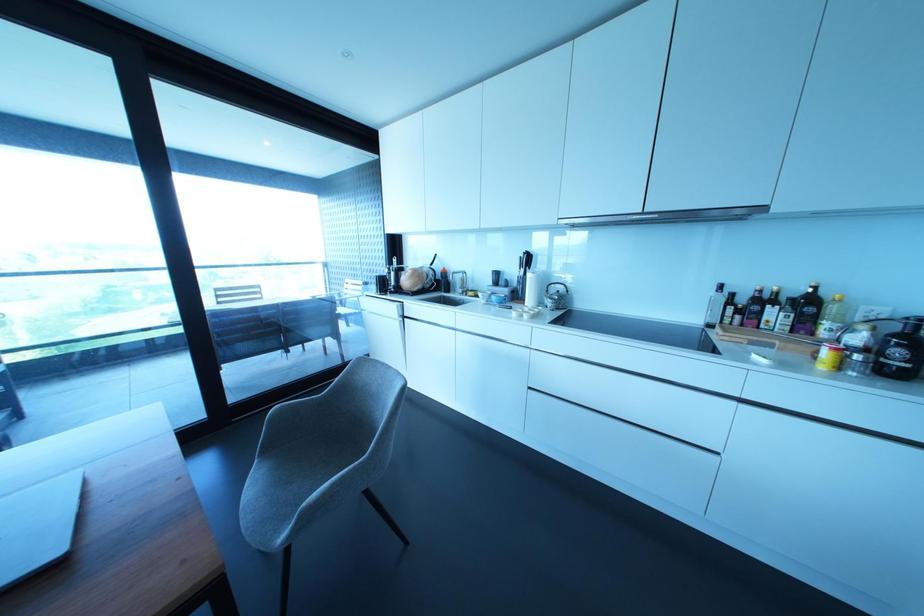
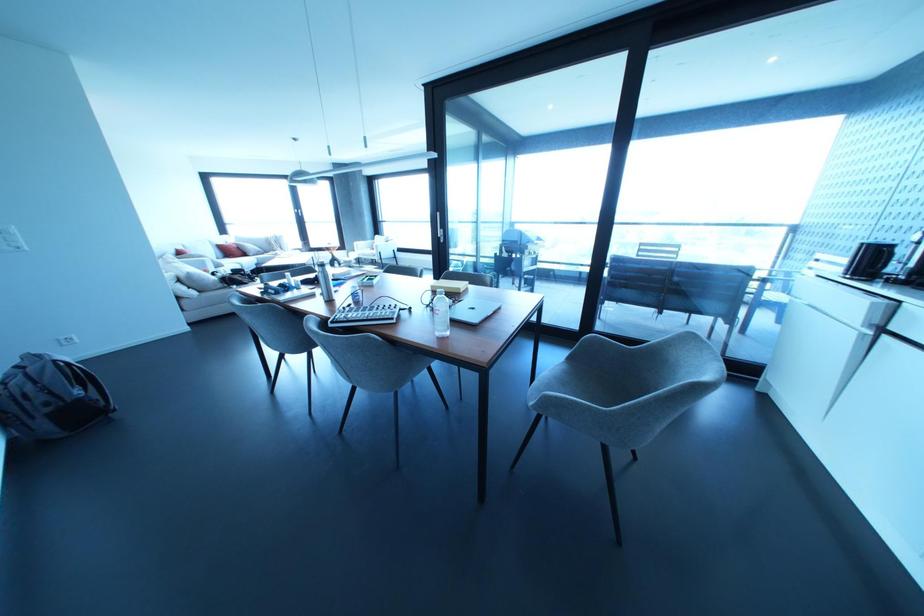
Find the pixel in the second image that matches pixel 334 385 in the first image.

(646, 346)